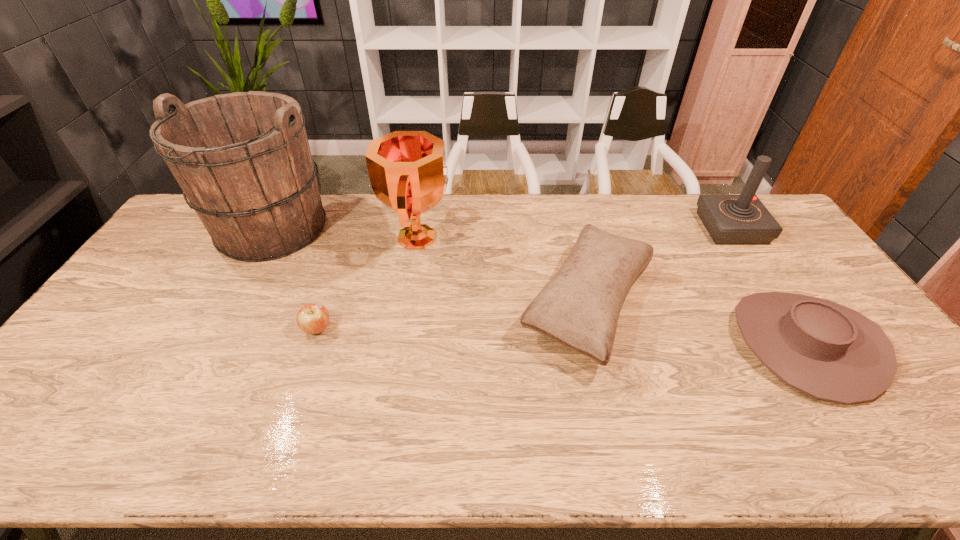
Find the location of a particular element. bucket is located at coordinates (242, 159).

You are a GUI agent. You are given a task and a screenshot of the screen. Output one action in this format:
    pyautogui.click(x=<x>, y=<y>)
    Task: Click on the tallest object
    The width and height of the screenshot is (960, 540).
    Given the screenshot: What is the action you would take?
    pyautogui.click(x=242, y=159)

You are a GUI agent. You are given a task and a screenshot of the screen. Output one action in this format:
    pyautogui.click(x=<x>, y=<y>)
    Task: Click on the award
    
    Given the screenshot: What is the action you would take?
    pyautogui.click(x=408, y=173)

Locate an element on the screen. This screenshot has height=540, width=960. the second tallest object is located at coordinates 408,173.

Where is `joystick`? Image resolution: width=960 pixels, height=540 pixels. joystick is located at coordinates (742, 219).

Find the location of a particular element. Image resolution: width=960 pixels, height=540 pixels. cushion is located at coordinates (579, 308).

Locate an element on the screen. the fourth object from left to right is located at coordinates (579, 308).

Identify the location of cowboy hat. (830, 352).

Identify the location of the shortest object. (313, 318).

Identify the location of the second object from left to right. The image size is (960, 540). [x=313, y=318].